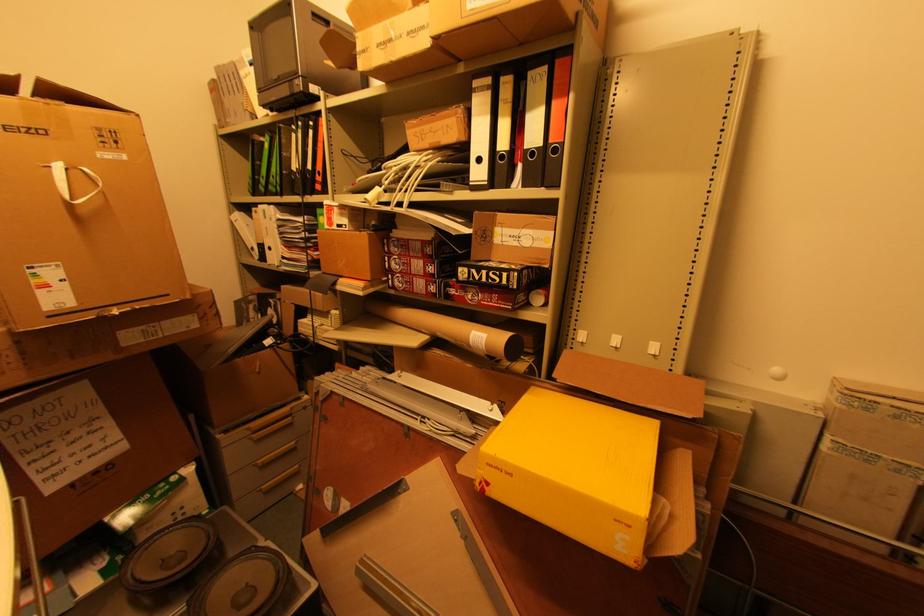
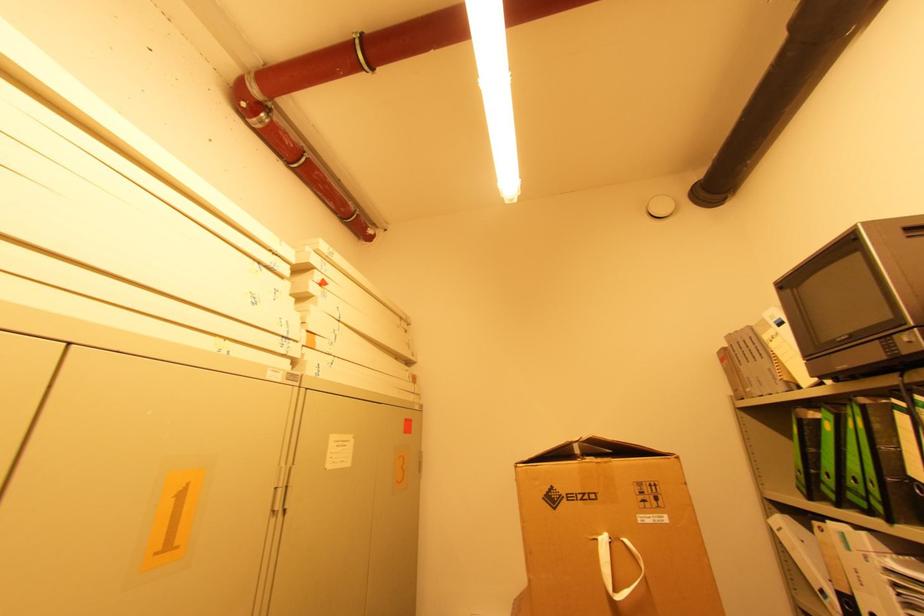
Find the pixel in the second image that matches point (285, 196) in the first image.

(894, 522)